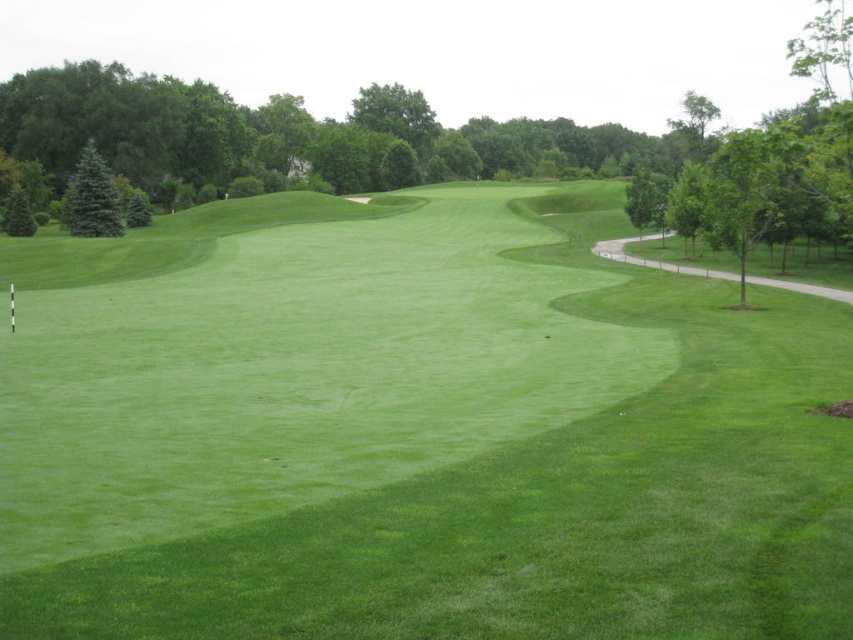
Does green smooth grass at center have a greater height compared to green leafy tree at left?

Indeed, green smooth grass at center has a greater height compared to green leafy tree at left.

Measure the distance between green smooth grass at center and camera.

green smooth grass at center is 6.06 meters from camera.

The image size is (853, 640). Find the location of `green smooth grass at center`. green smooth grass at center is located at coordinates (413, 433).

Identify the location of blue-green needle-like tree at upper left. (91, 196).

Who is shorter, blue-green needle-like tree at upper left or green leafy tree at left?

green leafy tree at left is shorter.

Does point (108, 168) come closer to viewer compared to point (32, 212)?

No, it is not.

Image resolution: width=853 pixels, height=640 pixels. What are the coordinates of `blue-green needle-like tree at upper left` in the screenshot? It's located at (91, 196).

Find the location of a particular element. The width and height of the screenshot is (853, 640). green smooth grass at center is located at coordinates (413, 433).